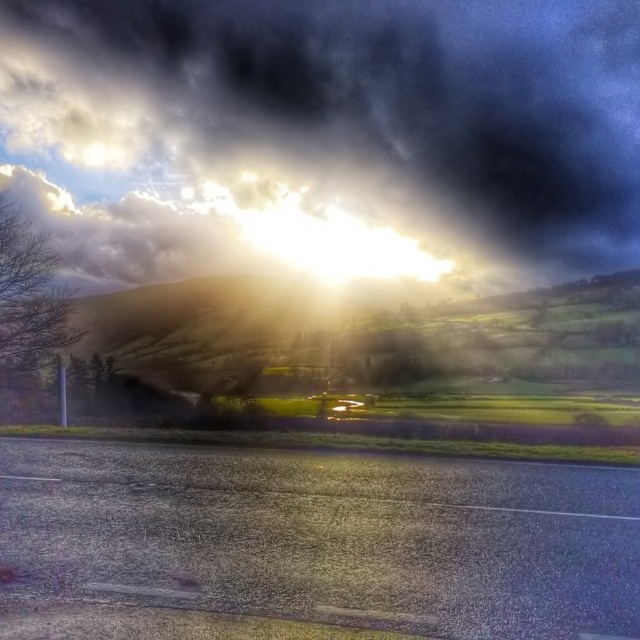
You are standing on the road in the foreground of the landscape scene. You see the dark gray cloud at upper center and the bare branches at left. Which object is higher in the sky?

The dark gray cloud at upper center is higher in the sky than the bare branches at left.

You are an artist planning to paint the scene. You want to emphasize the contrast between the dark gray cloud at upper center and the bare branches at left. Which object should you make larger in your painting to highlight this contrast?

The dark gray cloud at upper center should be made larger in the painting since it is already larger than the bare branches at left, enhancing the contrast between their sizes.

You are an artist trying to sketch this landscape. You want to ensure the dark gray cloud at upper center and the bare branches at left are proportionally accurate. Which object should you draw wider?

The dark gray cloud at upper center should be drawn wider because its width surpasses that of the bare branches at left.